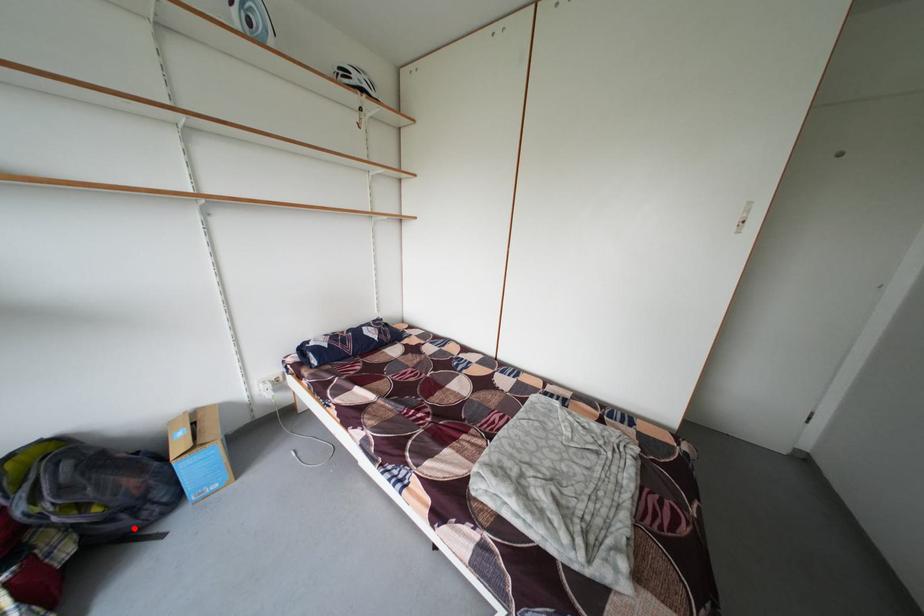
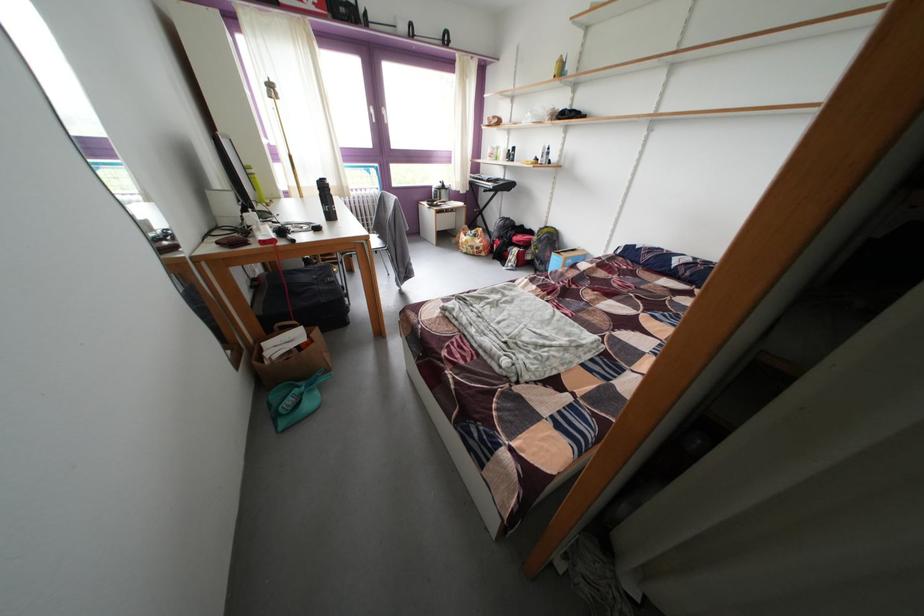
Question: I am providing you with two images of the same scene from different viewpoints. In image1, a red point is highlighted. Considering the same 3D point in image2, which of the following is correct?

Choices:
 (A) It is closer
 (B) It is farther

Answer: (B)